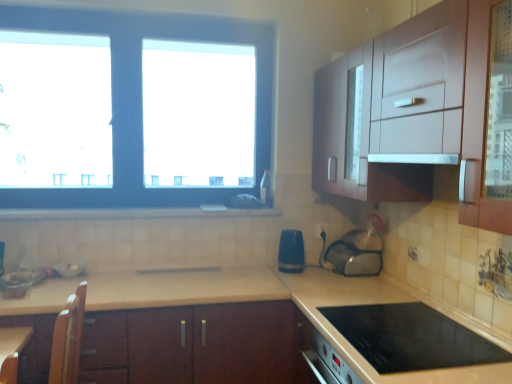
I want to click on free space to the right of blue plastic toaster at center, marked as the second appliance in a left-to-right arrangement, so click(x=321, y=270).